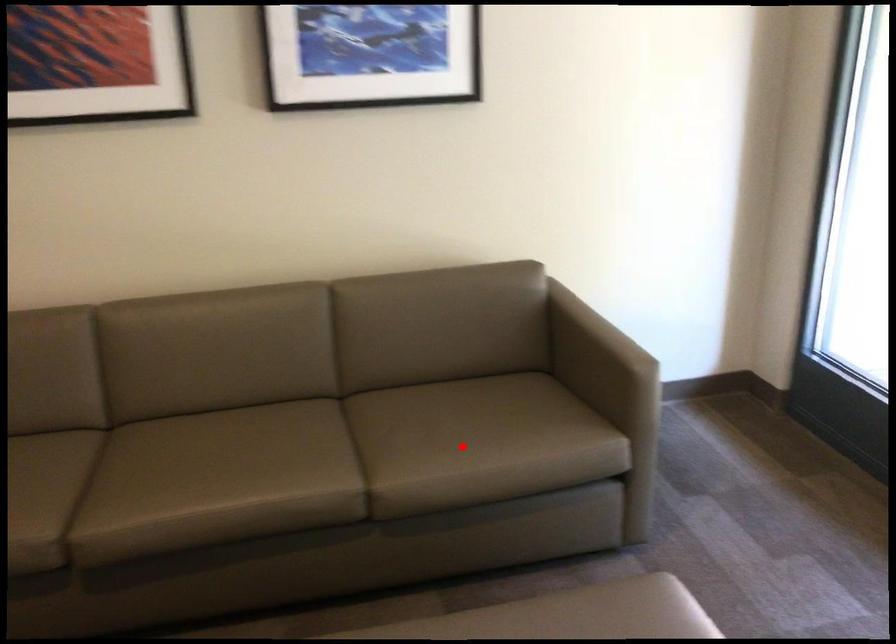
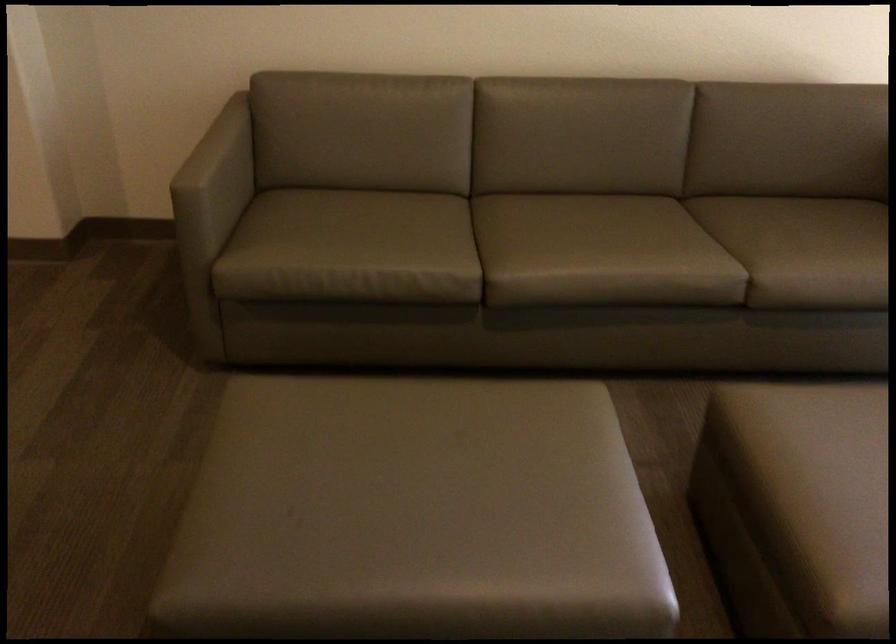
Question: I am providing you with two images of the same scene from different viewpoints. A red point is marked on the first image. Is the red point's position out of view in image 2?

Choices:
 (A) Yes
 (B) No

Answer: (B)